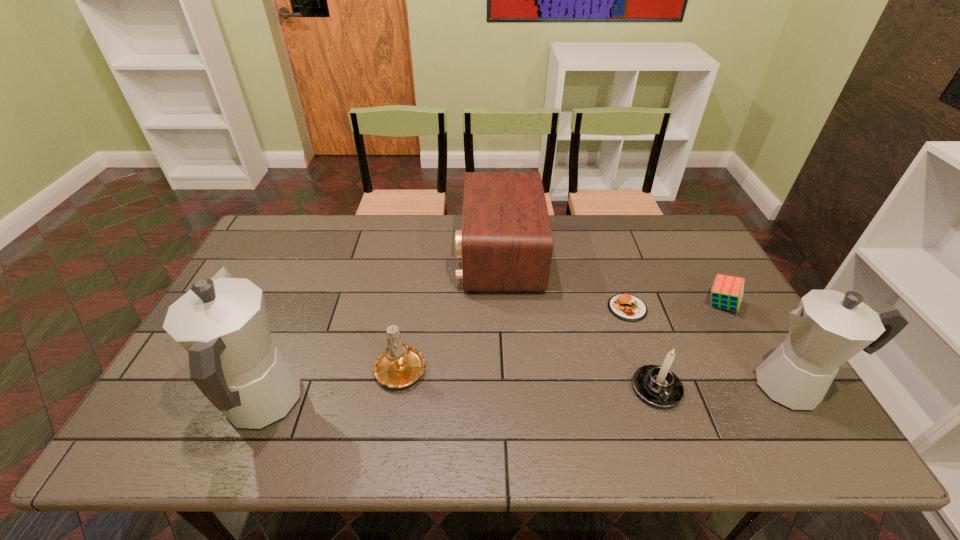
Find the location of a particular element. the taller coffeepot is located at coordinates (222, 322).

The width and height of the screenshot is (960, 540). I want to click on the left coffeepot, so click(222, 322).

Find the location of a particular element. the shorter coffeepot is located at coordinates (828, 328).

The height and width of the screenshot is (540, 960). I want to click on the right coffeepot, so click(x=828, y=328).

This screenshot has width=960, height=540. In order to click on the third object from left to right in this screenshot , I will do `click(506, 243)`.

Where is `the third tallest object`? Image resolution: width=960 pixels, height=540 pixels. the third tallest object is located at coordinates (506, 243).

Identify the location of patty (food). This screenshot has width=960, height=540. (627, 307).

Locate an element on the screen. This screenshot has width=960, height=540. the second shortest object is located at coordinates (727, 291).

I want to click on candle, so click(x=400, y=365).

Where is `candle holder`? This screenshot has height=540, width=960. candle holder is located at coordinates (657, 385).